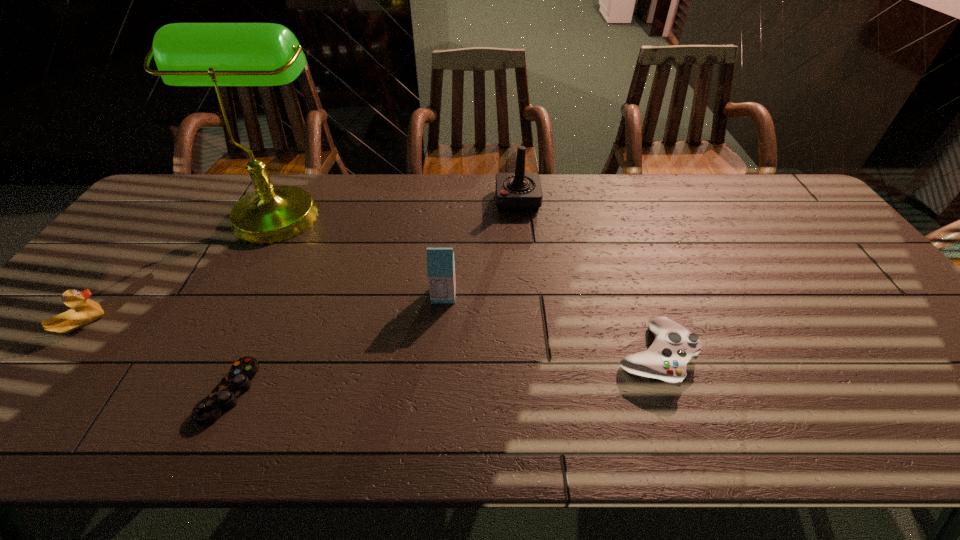
I want to click on free space between the tallest object and the second shortest object, so click(x=468, y=284).

Image resolution: width=960 pixels, height=540 pixels. I want to click on vacant region between the right control and the milk carton, so click(x=549, y=326).

At what (x,y) coordinates should I click in order to perform the action: click on vacant point located between the left control and the tallest object. Please return your answer as a coordinate pair (x, y). The image size is (960, 540). Looking at the image, I should click on (254, 301).

The height and width of the screenshot is (540, 960). What are the coordinates of `vacant point located between the third tallest object and the rightmost object` in the screenshot? It's located at pos(549,326).

Where is `free point between the shortest object and the tallest object`? free point between the shortest object and the tallest object is located at coordinates (254, 301).

Locate an element on the screen. unoccupied position between the rightmost object and the lamp is located at coordinates (468, 284).

Find the location of `blank region between the tallest object and the milk carton`. blank region between the tallest object and the milk carton is located at coordinates (362, 253).

This screenshot has height=540, width=960. What are the coordinates of `the fifth closest object to the right control` in the screenshot? It's located at point(83,311).

Locate which object is the fifth closest to the left control. Please provide its 2D coordinates. Your answer should be formatted as a tuple, i.e. [(x, y)], where the tuple contains the x and y coordinates of a point satisfying the conditions above.

[(674, 346)]

The image size is (960, 540). What are the coordinates of `vacant region that satisfies the following two spatial constraints: 1. on the desk next to the fourth nearest object; 2. on the right side of the tallest object` in the screenshot? It's located at (234, 295).